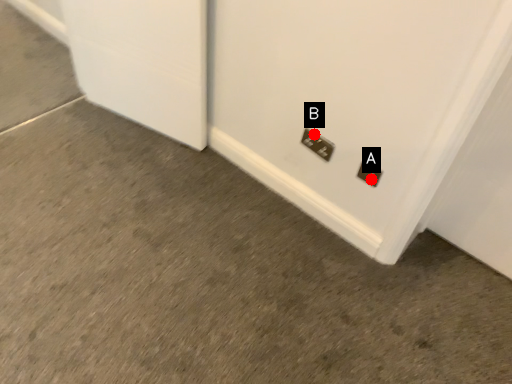
Question: Two points are circled on the image, labeled by A and B beside each circle. Which of the following is the closest to the observer?

Choices:
 (A) A is closer
 (B) B is closer

Answer: (A)